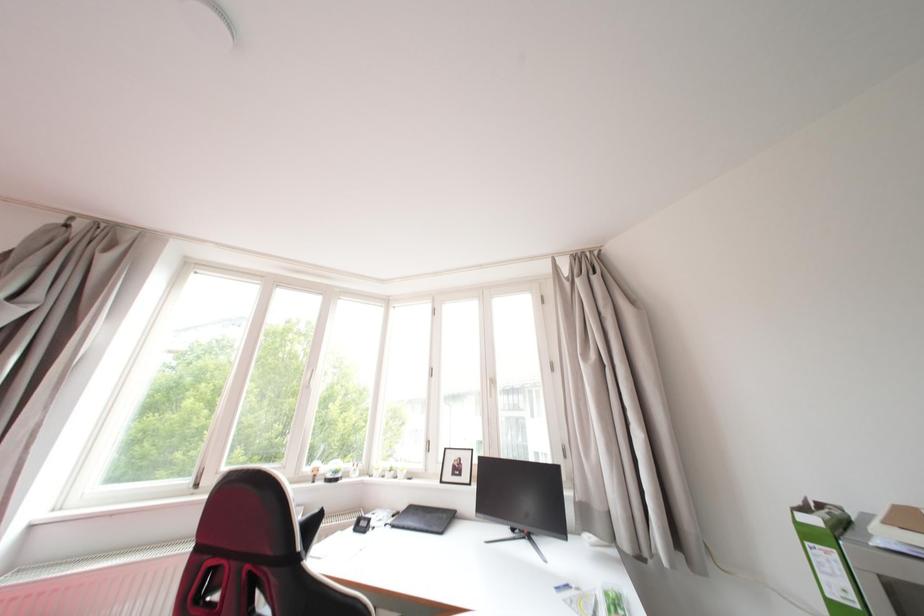
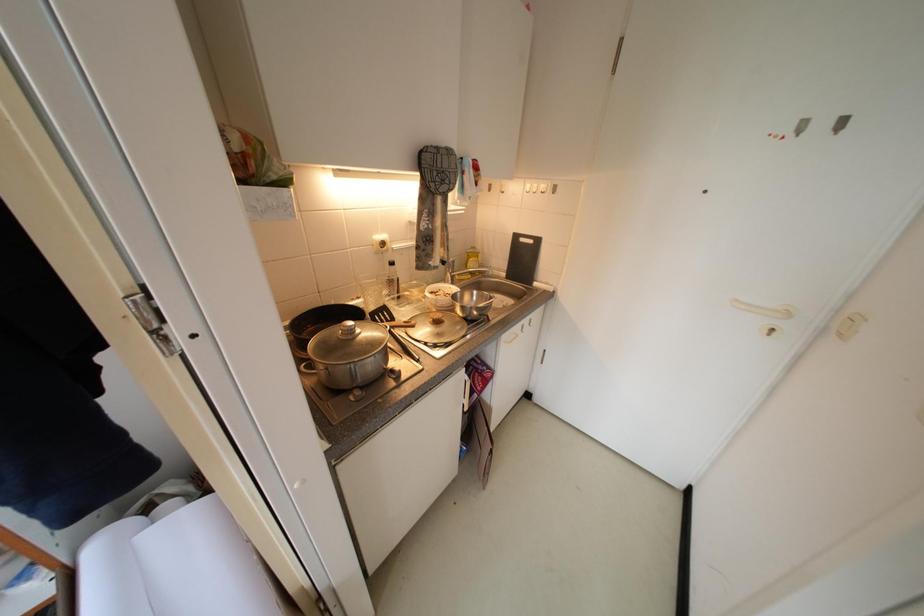
First-person continuous shooting, in which direction is the camera rotating?

The rotation direction of the camera is right-down.